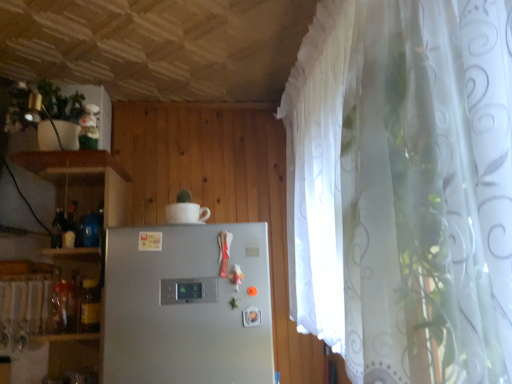
Question: Is white glossy cup at upper center facing away from satin silver refrigerator at center?

Choices:
 (A) yes
 (B) no

Answer: (B)

Question: Does white glossy cup at upper center appear on the left side of satin silver refrigerator at center?

Choices:
 (A) yes
 (B) no

Answer: (A)

Question: Is white glossy cup at upper center outside of satin silver refrigerator at center?

Choices:
 (A) yes
 (B) no

Answer: (A)

Question: From the image's perspective, does white glossy cup at upper center appear higher than satin silver refrigerator at center?

Choices:
 (A) yes
 (B) no

Answer: (A)

Question: Is white glossy cup at upper center smaller than satin silver refrigerator at center?

Choices:
 (A) yes
 (B) no

Answer: (A)

Question: From the image's perspective, is white glossy cup at upper center below satin silver refrigerator at center?

Choices:
 (A) yes
 (B) no

Answer: (B)

Question: From a real-world perspective, is satin silver refrigerator at center over white glossy cup at upper center?

Choices:
 (A) no
 (B) yes

Answer: (A)

Question: Is satin silver refrigerator at center behind white glossy cup at upper center?

Choices:
 (A) no
 (B) yes

Answer: (A)

Question: Does satin silver refrigerator at center lie in front of white glossy cup at upper center?

Choices:
 (A) yes
 (B) no

Answer: (A)

Question: Is satin silver refrigerator at center surrounding white glossy cup at upper center?

Choices:
 (A) no
 (B) yes

Answer: (A)

Question: Considering the relative sizes of satin silver refrigerator at center and white glossy cup at upper center in the image provided, is satin silver refrigerator at center wider than white glossy cup at upper center?

Choices:
 (A) yes
 (B) no

Answer: (A)

Question: From the image's perspective, is satin silver refrigerator at center on top of white glossy cup at upper center?

Choices:
 (A) yes
 (B) no

Answer: (B)

Question: Considering the positions of white glossy cup at upper center and satin silver refrigerator at center in the image, is white glossy cup at upper center bigger or smaller than satin silver refrigerator at center?

Choices:
 (A) small
 (B) big

Answer: (A)